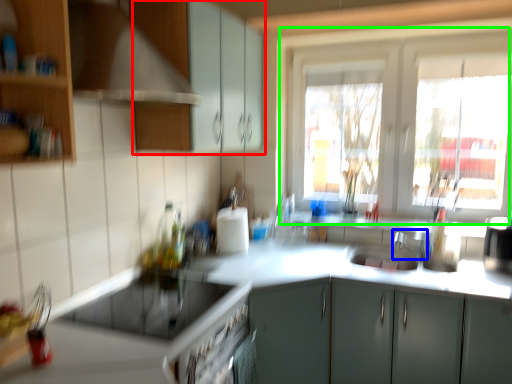
Question: Which object is positioned closest to cabinetry (highlighted by a red box)? Select from faucet (highlighted by a blue box) and window (highlighted by a green box).

Choices:
 (A) faucet
 (B) window

Answer: (B)